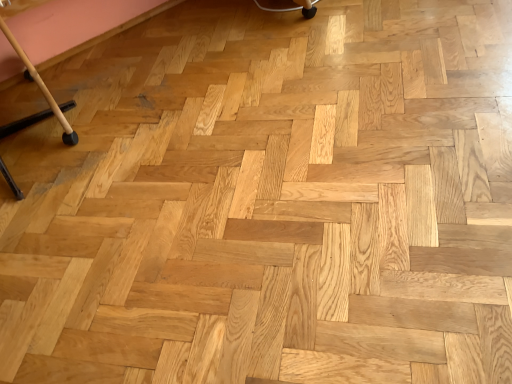
Image resolution: width=512 pixels, height=384 pixels. What are the coordinates of `wooden cane at left` in the screenshot? It's located at (44, 95).

Describe the element at coordinates (44, 95) in the screenshot. I see `wooden cane at left` at that location.

The image size is (512, 384). I want to click on wooden cane at left, so click(x=44, y=95).